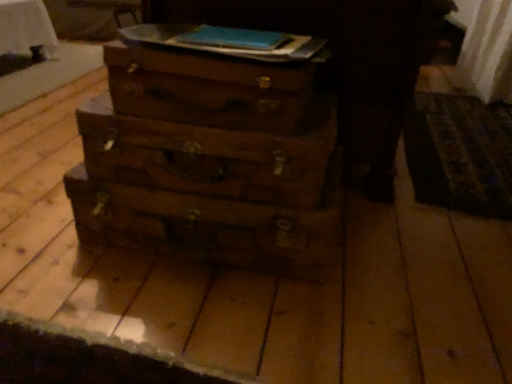
Question: From their relative heights in the image, would you say wooden drawer at center, the first drawer when ordered from bottom to top, is taller or shorter than wooden drawer at center, arranged as the second drawer when ordered from the bottom?

Choices:
 (A) tall
 (B) short

Answer: (B)

Question: Is wooden drawer at center, which is the third drawer in top-to-bottom order, wider or thinner than wooden drawer at center, arranged as the second drawer when ordered from the bottom?

Choices:
 (A) wide
 (B) thin

Answer: (A)

Question: Estimate the real-world distances between objects in this image. Which object is farther from the wooden drawer at center, arranged as the second drawer when ordered from the bottom?

Choices:
 (A) wooden chest at center
 (B) wooden drawer at center, the first drawer when ordered from bottom to top
 (C) wooden drawer at center, positioned as the third drawer in bottom-to-top order

Answer: (A)

Question: Estimate the real-world distances between objects in this image. Which object is closer to the wooden chest at center?

Choices:
 (A) wooden drawer at center, which is the third drawer in top-to-bottom order
 (B) wooden drawer at center, positioned as the third drawer in bottom-to-top order
 (C) wooden drawer at center, arranged as the second drawer when ordered from the bottom

Answer: (B)